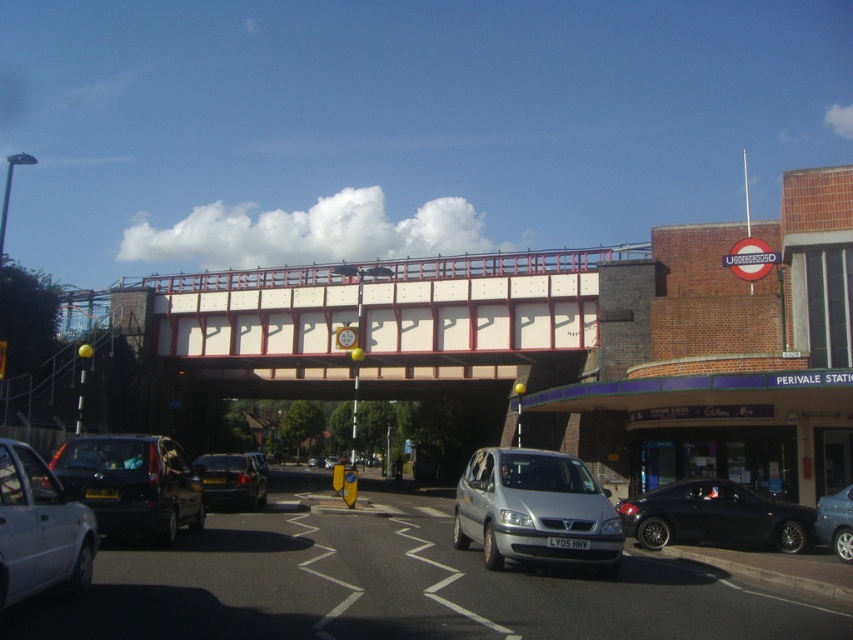
Question: Considering the relative positions of white painted concrete bridge at center and silver metallic car at lower left in the image provided, where is white painted concrete bridge at center located with respect to silver metallic car at lower left?

Choices:
 (A) below
 (B) above

Answer: (B)

Question: Estimate the real-world distances between objects in this image. Which object is closer to the black matte car at lower right?

Choices:
 (A) silver metallic van at center
 (B) silver metallic car at lower left

Answer: (A)

Question: Does white painted concrete bridge at center appear on the left side of blue metallic sedan at lower right?

Choices:
 (A) yes
 (B) no

Answer: (A)

Question: Is silver metallic car at lower left above black matte car at lower right?

Choices:
 (A) yes
 (B) no

Answer: (A)

Question: Which object is the farthest from the matte black van at lower left?

Choices:
 (A) silver metallic van at center
 (B) black matte car at lower right
 (C) silver metallic car at lower left

Answer: (B)

Question: Among these points, which one is farthest from the camera?

Choices:
 (A) (199, 474)
 (B) (399, 260)
 (C) (822, 538)
 (D) (202, 499)

Answer: (B)